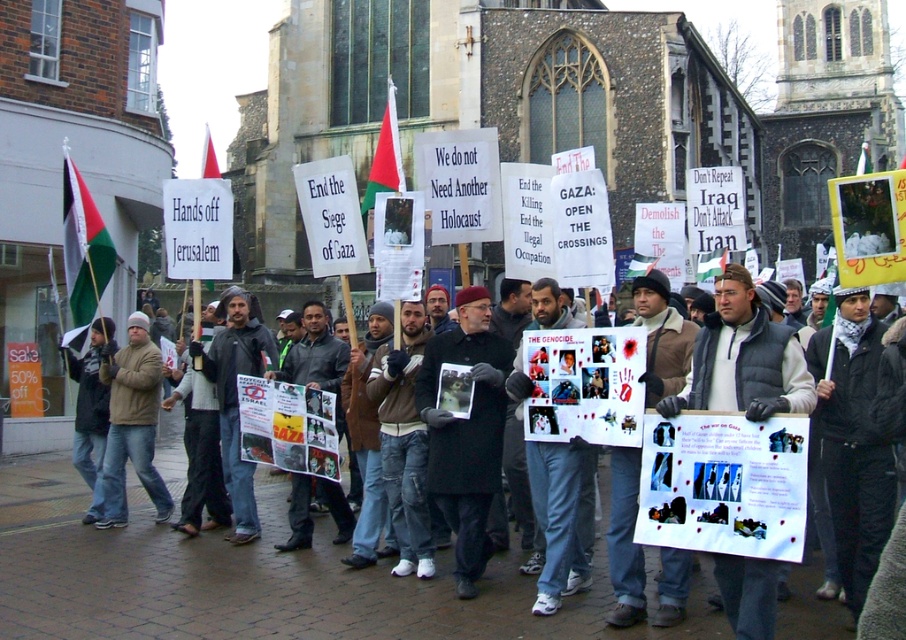
Question: Does white paper poster at center appear on the left side of red fabric flag at center?

Choices:
 (A) no
 (B) yes

Answer: (A)

Question: Which point is closer to the camera taking this photo?

Choices:
 (A) (79, 184)
 (B) (273, 529)
 (C) (378, 186)

Answer: (B)

Question: Which point appears farthest from the camera in this image?

Choices:
 (A) (386, 125)
 (B) (242, 564)

Answer: (A)

Question: Estimate the real-world distances between objects in this image. Which object is closer to the dark gray jacket at center?

Choices:
 (A) white fabric flag at center
 (B) red fabric flag at center
 (C) green-white-red-black fabric flag at left

Answer: (B)

Question: Does white paper poster at center have a greater width compared to brown leather jacket at left?

Choices:
 (A) yes
 (B) no

Answer: (A)

Question: Does brown leather jacket at left come behind green-white-red-black fabric flag at left?

Choices:
 (A) yes
 (B) no

Answer: (B)